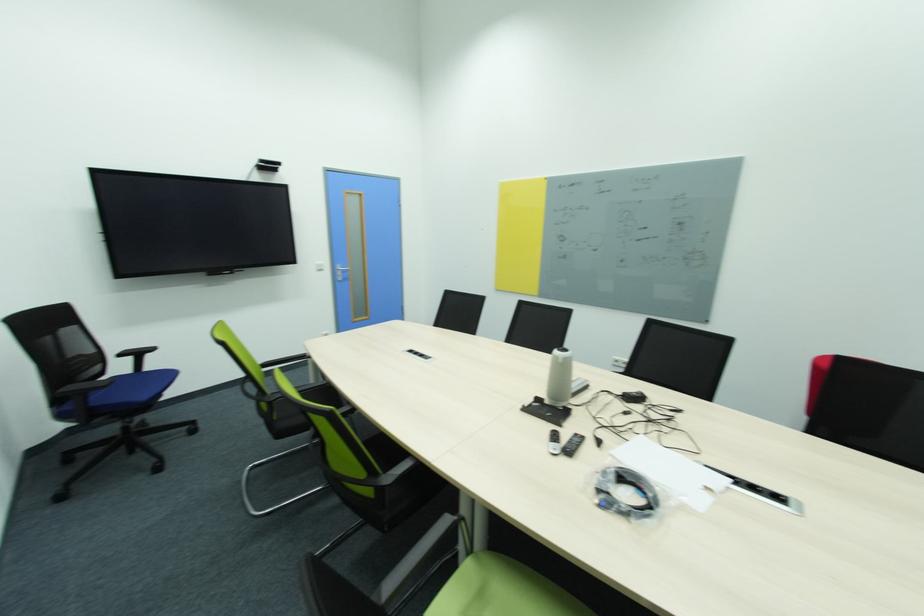
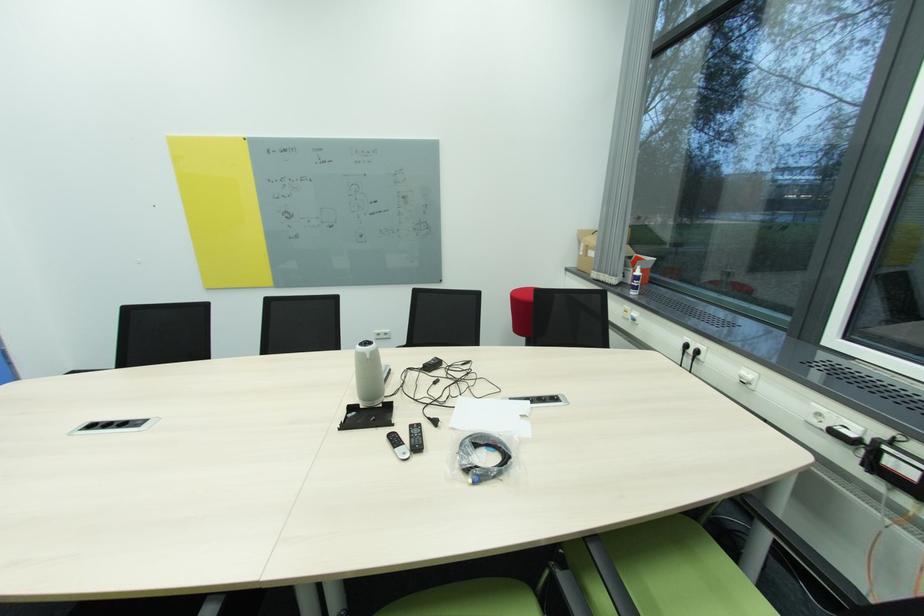
Question: The camera is either moving clockwise (left) or counter-clockwise (right) around the object. The first image is from the beginning of the video and the second image is from the end. Is the camera moving left or right when shooting the video?

Choices:
 (A) Left
 (B) Right

Answer: (A)